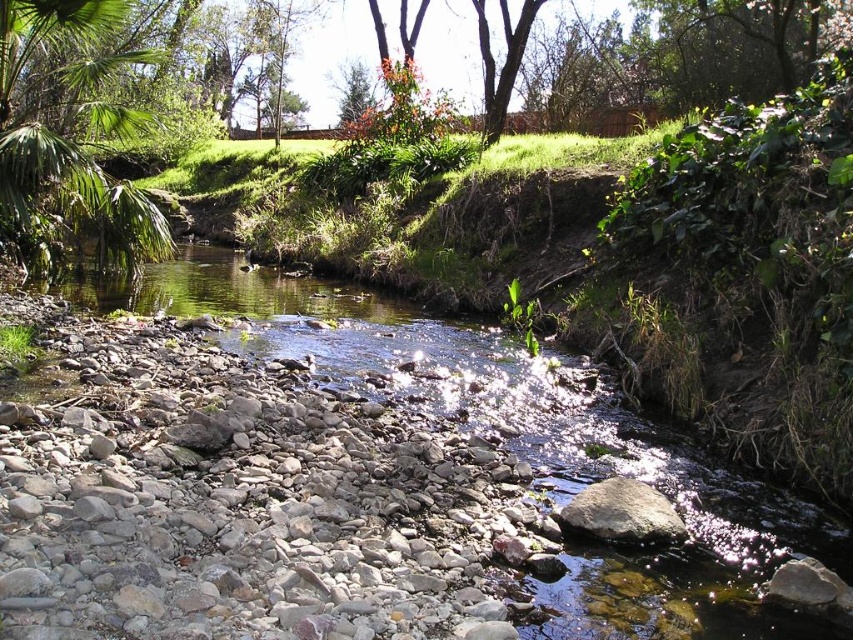
You are standing at the point with coordinates point [16,211] and want to reach the point with coordinates point [225,515]. Which direction should you move in to get there?

You should move forward because point [225,515] is in front of point [16,211].